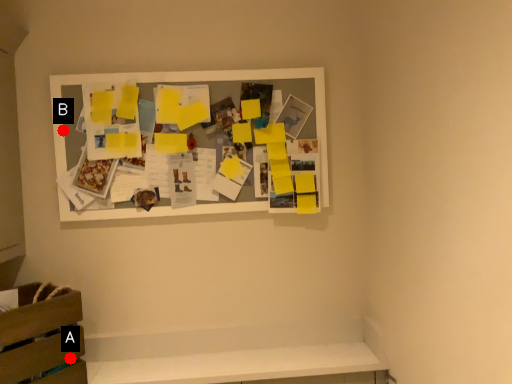
Question: Two points are circled on the image, labeled by A and B beside each circle. Which of the following is the farthest from the observer?

Choices:
 (A) A is further
 (B) B is further

Answer: (B)